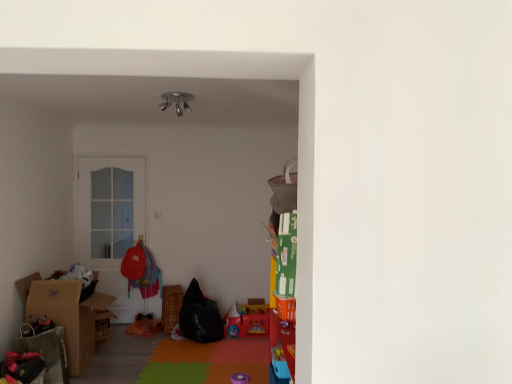
Question: Does black fabric bean bag at center, the 2th bean bag chair when ordered from right to left, appear on the right side of woven brown picnic basket at center?

Choices:
 (A) yes
 (B) no

Answer: (A)

Question: Could woven brown picnic basket at center be considered to be inside black fabric bean bag at center, the 2th bean bag chair when ordered from right to left?

Choices:
 (A) yes
 (B) no

Answer: (B)

Question: From a real-world perspective, is black fabric bean bag at center, arranged as the 1th bean bag chair when viewed from the left, positioned over woven brown picnic basket at center based on gravity?

Choices:
 (A) no
 (B) yes

Answer: (B)

Question: Is black fabric bean bag at center, arranged as the 1th bean bag chair when viewed from the left, not inside woven brown picnic basket at center?

Choices:
 (A) no
 (B) yes

Answer: (B)

Question: Could you tell me if black fabric bean bag at center, the 2th bean bag chair when ordered from right to left, is facing woven brown picnic basket at center?

Choices:
 (A) yes
 (B) no

Answer: (B)

Question: Considering the relative sizes of black fabric bean bag at center, arranged as the 1th bean bag chair when viewed from the left, and woven brown picnic basket at center in the image provided, is black fabric bean bag at center, arranged as the 1th bean bag chair when viewed from the left, shorter than woven brown picnic basket at center?

Choices:
 (A) yes
 (B) no

Answer: (B)

Question: From a real-world perspective, does brown cardboard box at left stand above matte plastic toy at center?

Choices:
 (A) yes
 (B) no

Answer: (A)

Question: Is brown cardboard box at left to the right of matte plastic toy at center from the viewer's perspective?

Choices:
 (A) yes
 (B) no

Answer: (B)

Question: Is brown cardboard box at left positioned beyond the bounds of matte plastic toy at center?

Choices:
 (A) yes
 (B) no

Answer: (A)

Question: Is brown cardboard box at left far away from matte plastic toy at center?

Choices:
 (A) yes
 (B) no

Answer: (A)

Question: Is brown cardboard box at left surrounding matte plastic toy at center?

Choices:
 (A) no
 (B) yes

Answer: (A)

Question: Does brown cardboard box at left have a greater height compared to matte plastic toy at center?

Choices:
 (A) yes
 (B) no

Answer: (A)

Question: Are matte plastic toy at center and metallic chrome lamp at upper center making contact?

Choices:
 (A) yes
 (B) no

Answer: (B)